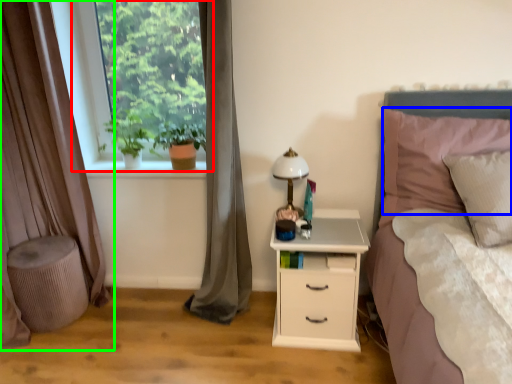
Question: Estimate the real-world distances between objects in this image. Which object is farther from window (highlighted by a red box), pillow (highlighted by a blue box) or curtain (highlighted by a green box)?

Choices:
 (A) pillow
 (B) curtain

Answer: (A)